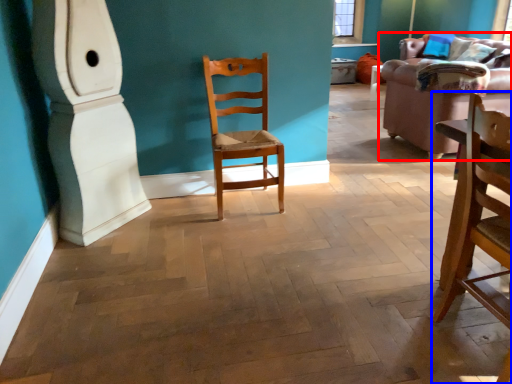
Question: Which object is further to the camera taking this photo, studio couch (highlighted by a red box) or chair (highlighted by a blue box)?

Choices:
 (A) studio couch
 (B) chair

Answer: (A)